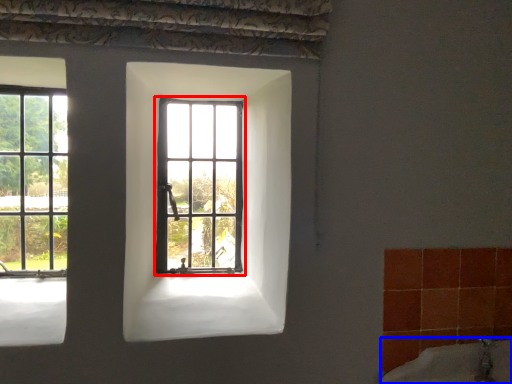
Question: Which object is further to the camera taking this photo, window (highlighted by a red box) or bath (highlighted by a blue box)?

Choices:
 (A) window
 (B) bath

Answer: (A)